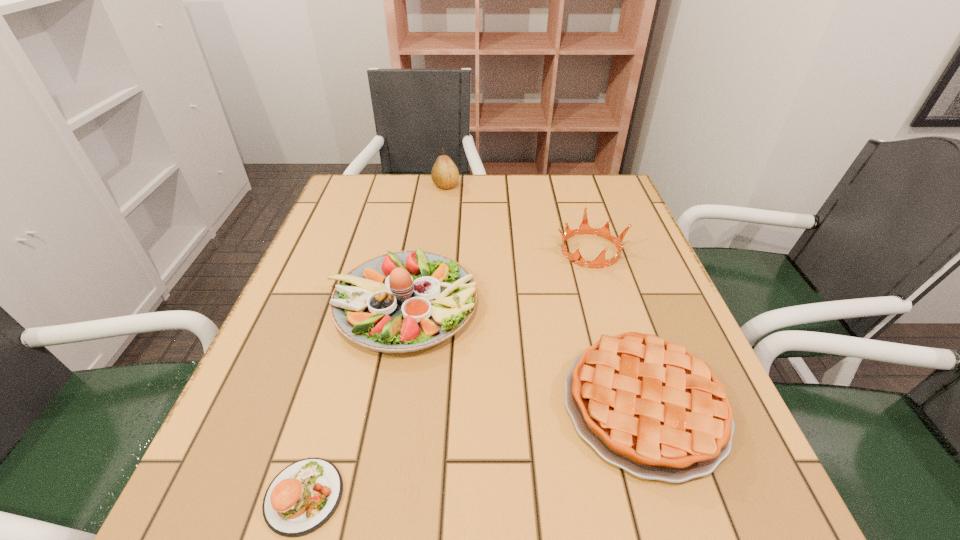
Where is `vacant space at the near edge of the desktop`? This screenshot has width=960, height=540. vacant space at the near edge of the desktop is located at coordinates (407, 494).

Identify the location of vacant area at the left edge. (363, 227).

At what (x,y) coordinates should I click in order to perform the action: click on vacant space at the right edge. Please return your answer as a coordinate pair (x, y). Looking at the image, I should click on (624, 247).

Where is `vacant area at the far left corner of the desktop`? The width and height of the screenshot is (960, 540). vacant area at the far left corner of the desktop is located at coordinates (363, 183).

Locate an element on the screen. free space at the far right corner of the desktop is located at coordinates (575, 190).

This screenshot has width=960, height=540. What are the coordinates of `vacant area that lies between the crown and the shortest object` in the screenshot? It's located at (447, 373).

I want to click on unoccupied area between the third tallest object and the salad plate, so click(496, 277).

The height and width of the screenshot is (540, 960). Identify the location of unoccupied area between the farthest object and the salad plate. (423, 245).

Where is `vacant area between the pear and the pie`? vacant area between the pear and the pie is located at coordinates (545, 295).

Image resolution: width=960 pixels, height=540 pixels. I want to click on free spot between the farthest object and the pie, so click(x=545, y=295).